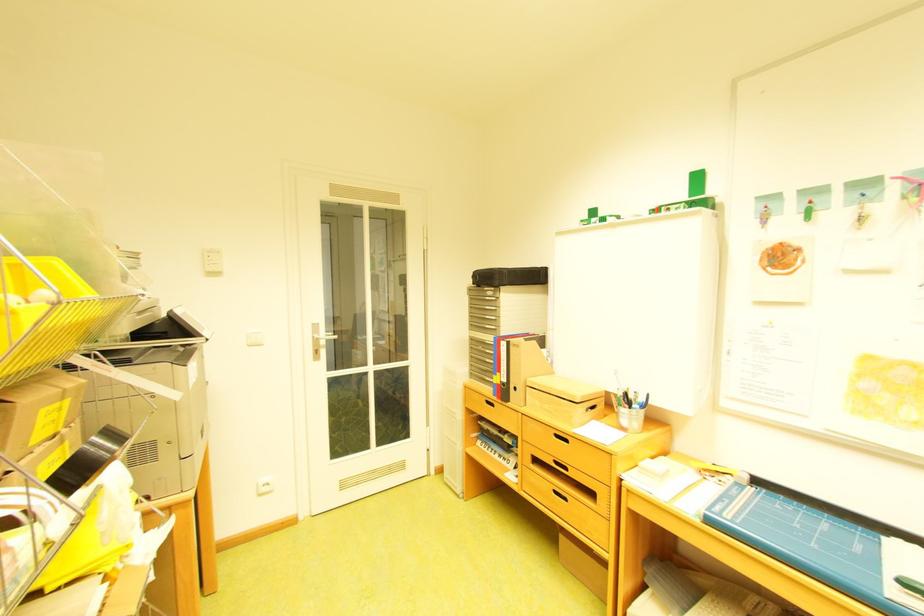
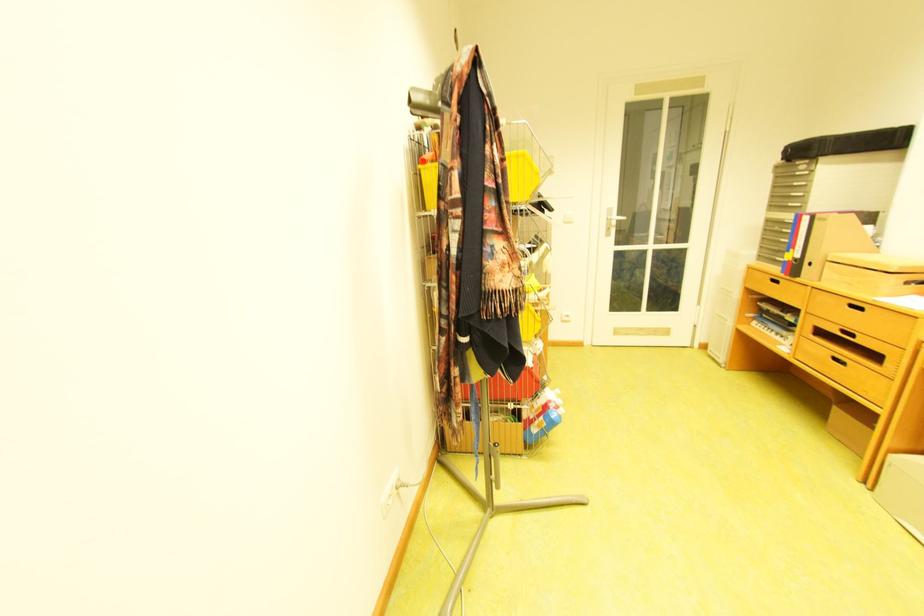
The point at [496,290] is marked in the first image. Where is the corresponding point in the second image?

(808, 164)